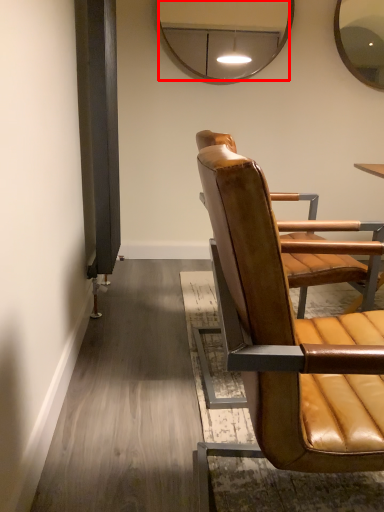
Question: From the image, what is the correct spatial relationship of mirror (annotated by the red box) in relation to chair?

Choices:
 (A) left
 (B) right

Answer: (A)